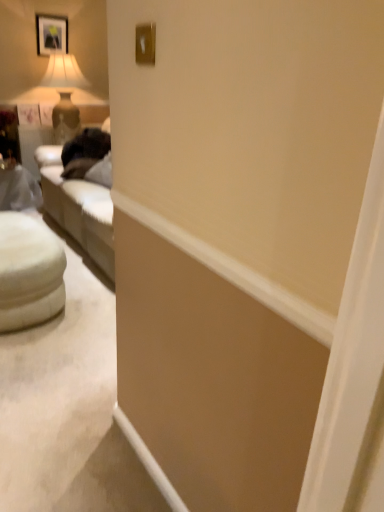
In order to face matte black picture frame at upper left, should I rotate leftwards or rightwards?

Rotate left and turn 18.198 degrees.

What do you see at coordinates (51, 34) in the screenshot? This screenshot has width=384, height=512. I see `matte black picture frame at upper left` at bounding box center [51, 34].

You are a GUI agent. You are given a task and a screenshot of the screen. Output one action in this format:
    pyautogui.click(x=<x>, y=<y>)
    Task: Click on the matte black picture frame at upper left
    The width and height of the screenshot is (384, 512).
    Given the screenshot: What is the action you would take?
    pyautogui.click(x=51, y=34)

Locate an element on the screen. matte black picture frame at upper left is located at coordinates (51, 34).